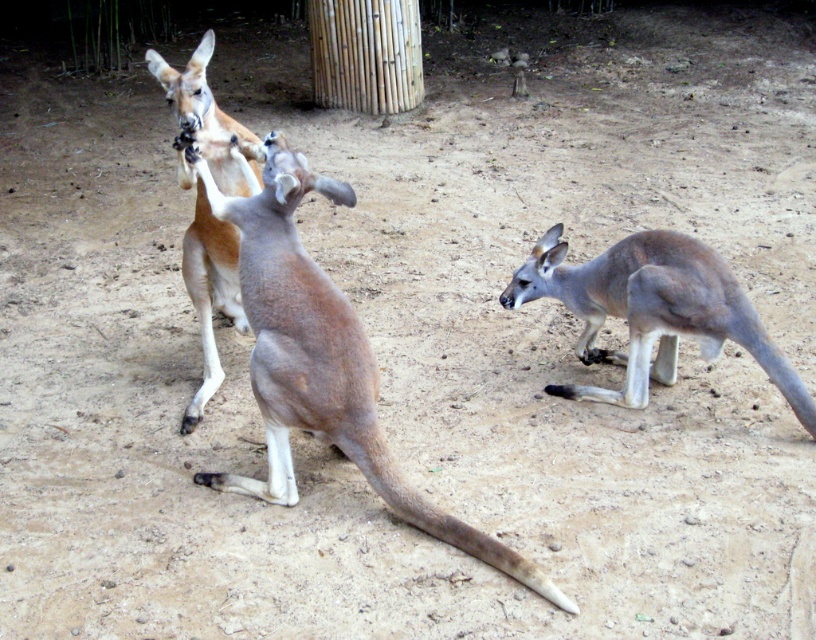
Is light brown fur kangaroo at center to the right of brown fur kangaroo at center from the viewer's perspective?

Indeed, light brown fur kangaroo at center is positioned on the right side of brown fur kangaroo at center.

You are a GUI agent. You are given a task and a screenshot of the screen. Output one action in this format:
    pyautogui.click(x=<x>, y=<y>)
    Task: Click on the light brown fur kangaroo at center
    This screenshot has width=816, height=640.
    Given the screenshot: What is the action you would take?
    pyautogui.click(x=318, y=356)

Can you confirm if light brown fur kangaroo at center is thinner than grayish-brown fur at right?

No.

Is point (293, 292) less distant than point (701, 256)?

Yes, it is.

Is point (296, 150) in front of point (601, 323)?

No, (296, 150) is further to viewer.

Where is `light brown fur kangaroo at center`? The height and width of the screenshot is (640, 816). light brown fur kangaroo at center is located at coordinates (318, 356).

Locate an element on the screen. grayish-brown fur at right is located at coordinates (652, 310).

Which is more to the right, grayish-brown fur at right or brown fur kangaroo at center?

grayish-brown fur at right is more to the right.

Identify the location of grayish-brown fur at right. (652, 310).